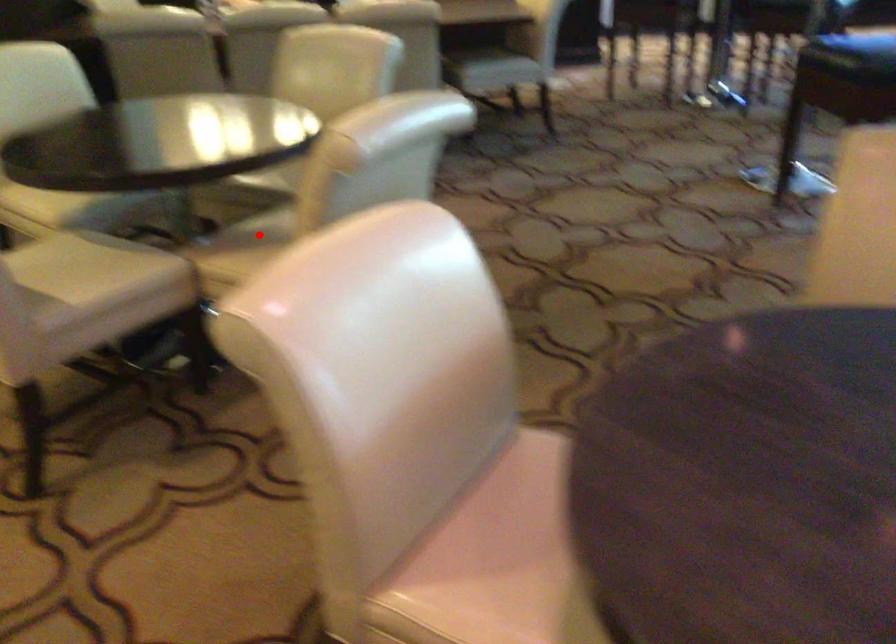
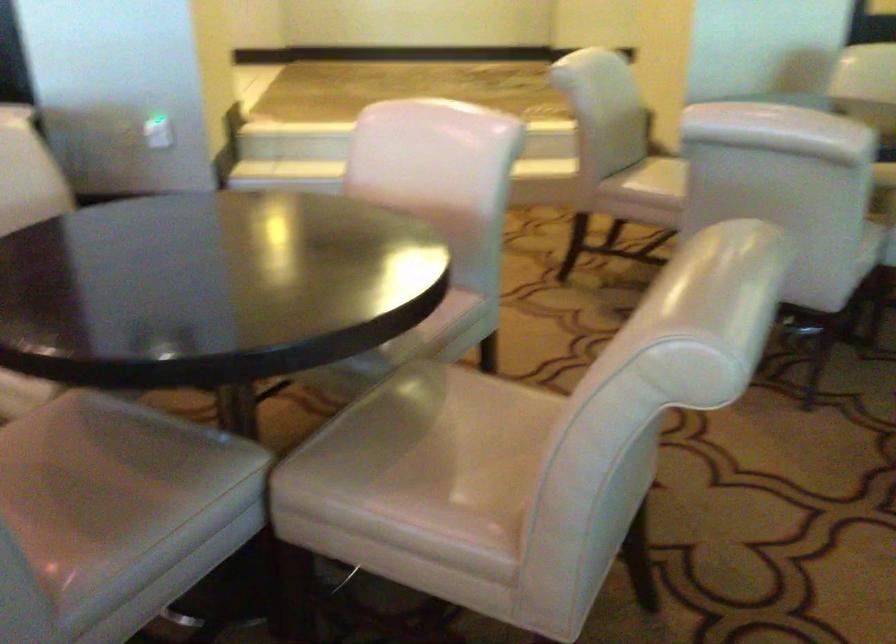
Question: I am providing you with two images of the same scene from different viewpoints. A red point is marked on the first image. Is the red point's position out of view in image 2?

Choices:
 (A) Yes
 (B) No

Answer: (A)